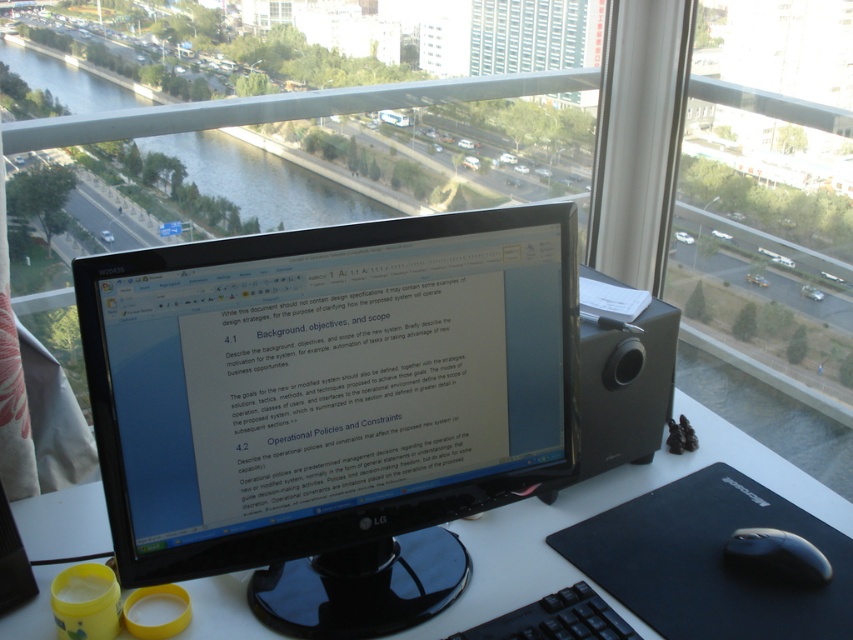
You are sitting at a desk and want to reach for the black glossy monitor at center. Considering your arm can only extend 30 inches, can you comfortably reach it?

The black glossy monitor at center is 31.57 inches from viewer, which is beyond your arm extension of 30 inches, so you cannot comfortably reach it.

You are sitting at the desk in the workspace and want to reach both the point at coordinates point (590, 529) and point (552, 1). Which point is closer to you?

Point (590, 529) is in front of point (552, 1), so you will reach point (590, 529) first since it is closer to you.

You are organizing a desk and need to place a tall plant that requires 30 cm of vertical space. Given the transparent glass window at upper center and the black matte mouse at lower right, which object has enough vertical space to accommodate the plant?

The transparent glass window at upper center has a greater height compared to the black matte mouse at lower right, so it can accommodate the plant requiring 30 cm of vertical space.